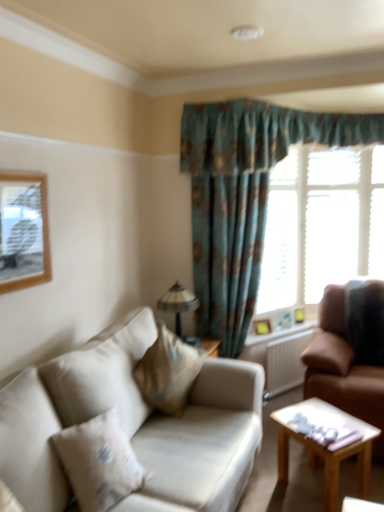
Identify the location of vacant space to the right of wooden picture frame at right, placed as the second picture frame when sorted from top to bottom. (289, 331).